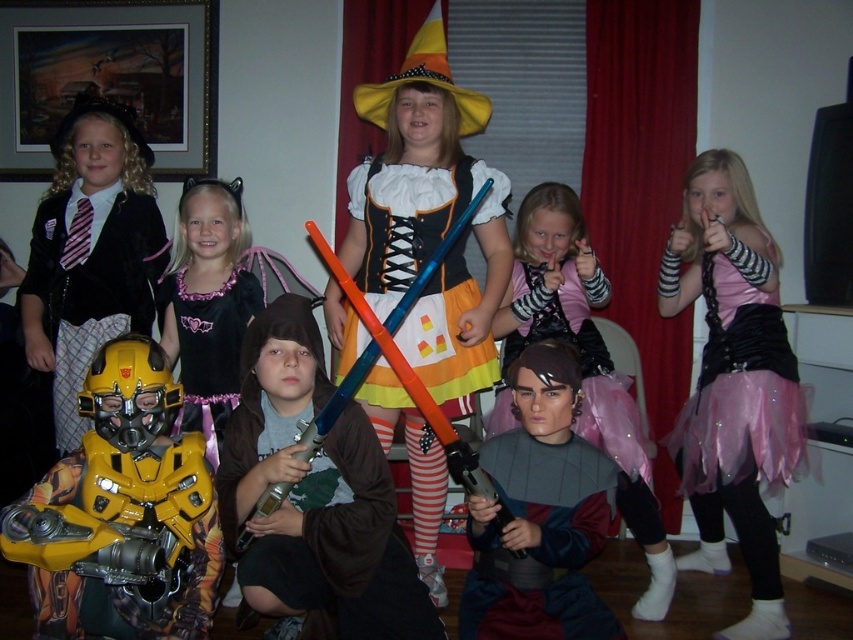
Is orange and yellow striped stockings at center wider than metallic silver armor at center?

Indeed, orange and yellow striped stockings at center has a greater width compared to metallic silver armor at center.

Which of these two, orange and yellow striped stockings at center or metallic silver armor at center, stands shorter?

metallic silver armor at center is shorter.

Is point (442, 353) positioned after point (567, 448)?

Yes, point (442, 353) is farther from viewer.

Where is `orange and yellow striped stockings at center`? The image size is (853, 640). orange and yellow striped stockings at center is located at coordinates (428, 220).

Consider the image. Which is above, pink tulle skirt at right or pink satin tutu at center?

Positioned higher is pink tulle skirt at right.

Between pink tulle skirt at right and pink satin tutu at center, which one has more height?

Standing taller between the two is pink tulle skirt at right.

Who is more forward, [699,259] or [570,273]?

Point [570,273] is more forward.

Locate an element on the screen. Image resolution: width=853 pixels, height=640 pixels. pink tulle skirt at right is located at coordinates (733, 381).

Can you confirm if velvet black dress at upper left is positioned above pink satin tutu at center?

Indeed, velvet black dress at upper left is positioned over pink satin tutu at center.

Between velvet black dress at upper left and pink satin tutu at center, which one appears on the right side from the viewer's perspective?

pink satin tutu at center is more to the right.

Is point (56, 442) positioned after point (635, 605)?

That is True.

Where is `velvet black dress at upper left`? The height and width of the screenshot is (640, 853). velvet black dress at upper left is located at coordinates (90, 252).